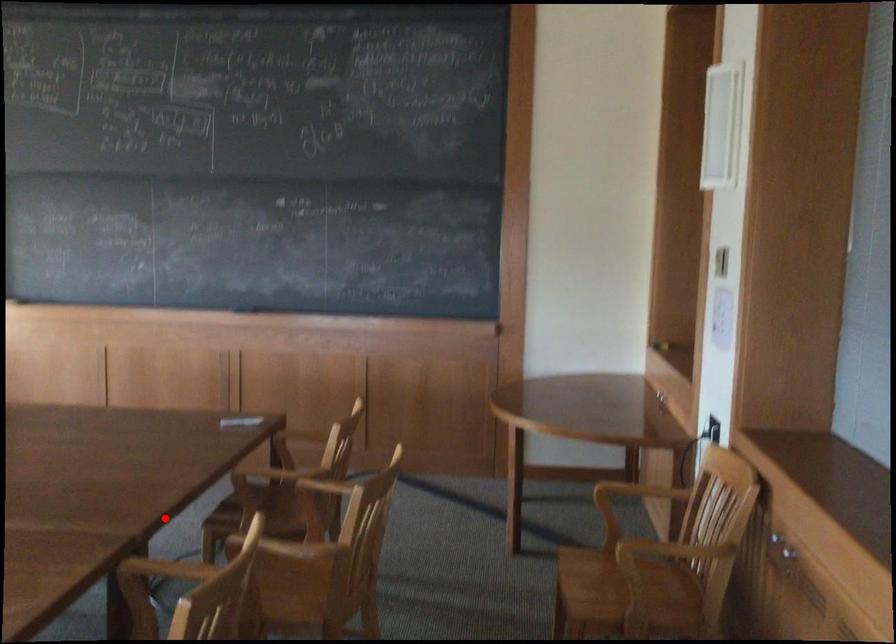
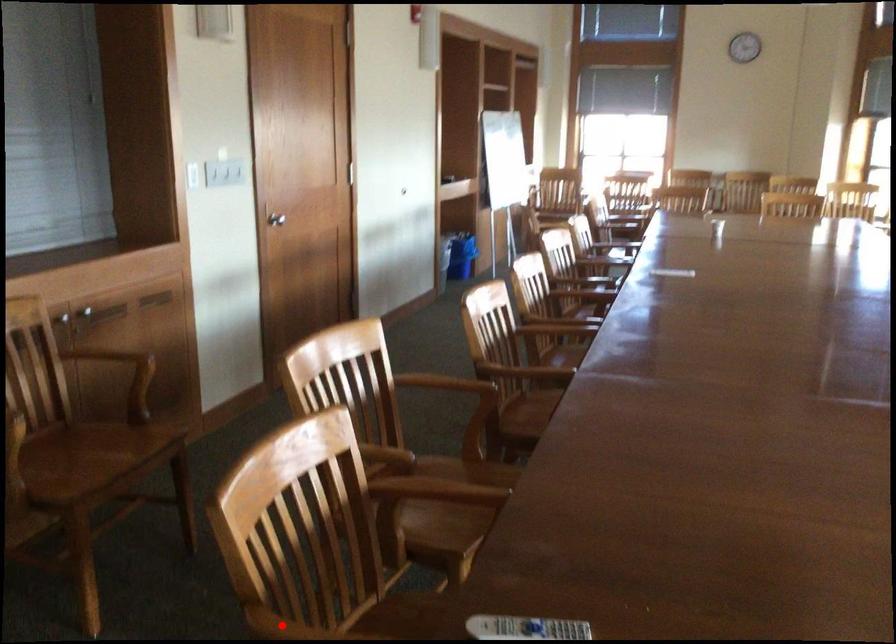
I am providing you with two images of the same scene from different viewpoints. A red point is marked on the first image and another point is marked on the second image. Does the point marked in image1 correspond to the same location as the one in image2?

No